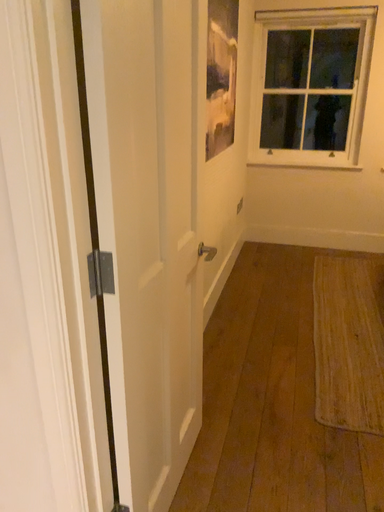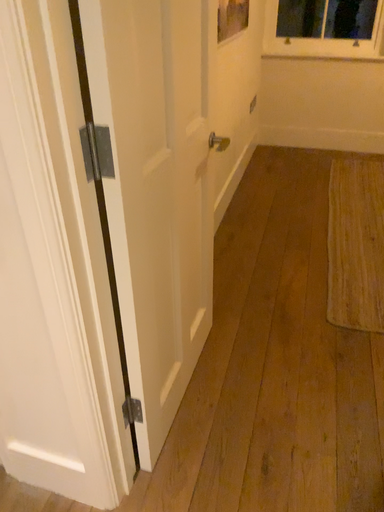
Question: How did the camera likely rotate when shooting the video?

Choices:
 (A) rotated upward
 (B) rotated downward

Answer: (B)